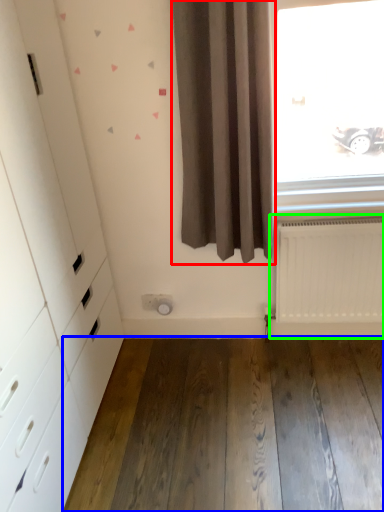
Question: Which object is the closest to the curtain (highlighted by a red box)? Choose among these: hardwood (highlighted by a blue box) or radiator (highlighted by a green box).

Choices:
 (A) hardwood
 (B) radiator

Answer: (B)